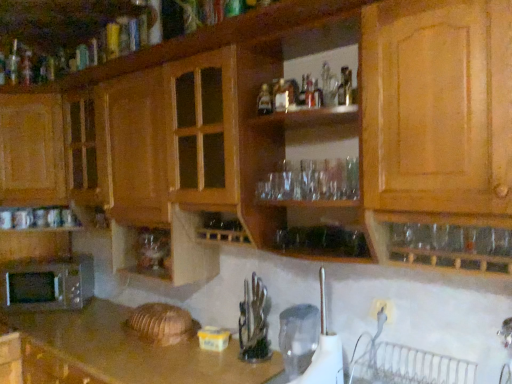
Question: From a real-world perspective, does wooden cabinet at center, which is counted as the 1th cabinetry, starting from the bottom, sit lower than wooden cutting board at lower left?

Choices:
 (A) no
 (B) yes

Answer: (A)

Question: From a real-world perspective, is wooden cabinet at center, which is counted as the 1th cabinetry, starting from the bottom, over wooden cutting board at lower left?

Choices:
 (A) yes
 (B) no

Answer: (A)

Question: Are wooden cabinet at center, the 3th cabinetry viewed from the top, and wooden cutting board at lower left located far from each other?

Choices:
 (A) yes
 (B) no

Answer: (B)

Question: Does wooden cabinet at center, the 3th cabinetry viewed from the top, touch wooden cutting board at lower left?

Choices:
 (A) no
 (B) yes

Answer: (A)

Question: Can you confirm if wooden cabinet at center, the 3th cabinetry viewed from the top, is shorter than wooden cutting board at lower left?

Choices:
 (A) yes
 (B) no

Answer: (B)

Question: Considering the relative sizes of wooden cabinet at center, the 3th cabinetry viewed from the top, and wooden cutting board at lower left in the image provided, is wooden cabinet at center, the 3th cabinetry viewed from the top, thinner than wooden cutting board at lower left?

Choices:
 (A) no
 (B) yes

Answer: (A)

Question: Is there a large distance between wooden cabinet at center, which is counted as the 1th cabinetry, starting from the bottom, and wooden cabinet at upper center, arranged as the 3th cabinetry when ordered from the bottom?

Choices:
 (A) no
 (B) yes

Answer: (A)

Question: Considering the relative sizes of wooden cabinet at center, which is counted as the 1th cabinetry, starting from the bottom, and wooden cabinet at upper center, arranged as the 1th cabinetry when viewed from the top, in the image provided, is wooden cabinet at center, which is counted as the 1th cabinetry, starting from the bottom, shorter than wooden cabinet at upper center, arranged as the 1th cabinetry when viewed from the top,?

Choices:
 (A) yes
 (B) no

Answer: (B)

Question: Could you tell me if wooden cabinet at center, the 3th cabinetry viewed from the top, is turned towards wooden cabinet at upper center, arranged as the 3th cabinetry when ordered from the bottom?

Choices:
 (A) yes
 (B) no

Answer: (B)

Question: From a real-world perspective, is wooden cabinet at center, the 3th cabinetry viewed from the top, below wooden cabinet at upper center, arranged as the 1th cabinetry when viewed from the top?

Choices:
 (A) yes
 (B) no

Answer: (A)

Question: Considering the relative positions of wooden cabinet at center, the 3th cabinetry viewed from the top, and wooden cabinet at upper center, arranged as the 1th cabinetry when viewed from the top, in the image provided, is wooden cabinet at center, the 3th cabinetry viewed from the top, to the left of wooden cabinet at upper center, arranged as the 1th cabinetry when viewed from the top, from the viewer's perspective?

Choices:
 (A) no
 (B) yes

Answer: (A)

Question: Does wooden cabinet at center, the 3th cabinetry viewed from the top, appear on the right side of wooden cabinet at upper center, arranged as the 3th cabinetry when ordered from the bottom?

Choices:
 (A) yes
 (B) no

Answer: (A)

Question: From the image's perspective, is wooden cabinet at upper center, arranged as the 3th cabinetry when ordered from the bottom, under white plastic kettle at lower center, which is counted as the 1th appliance, starting from the front?

Choices:
 (A) no
 (B) yes

Answer: (A)